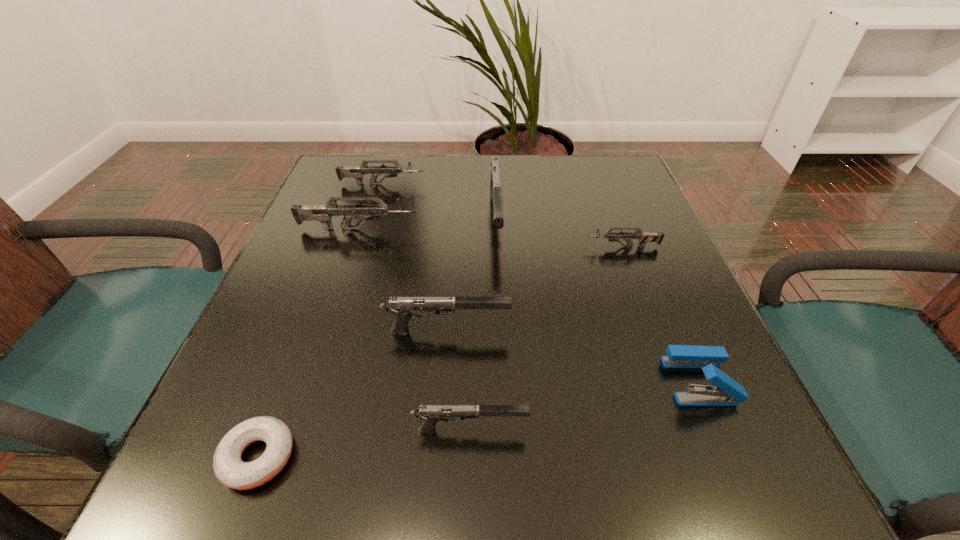
Identify the location of vacant space in between the blue stapler and the farthest gun. This screenshot has height=540, width=960. (540, 282).

The width and height of the screenshot is (960, 540). In order to click on vacant space that's between the fifth farthest gun and the farthest gun in this screenshot , I will do `click(415, 257)`.

Identify the location of vacant area that lies between the blue stapler and the biggest grey gun. The height and width of the screenshot is (540, 960). (529, 305).

Find the location of a particular element. empty location between the shortest object and the smallest gray gun is located at coordinates (364, 443).

You are a GUI agent. You are given a task and a screenshot of the screen. Output one action in this format:
    pyautogui.click(x=<x>, y=<y>)
    Task: Click on the vacant area that lies between the smallest grey gun and the second nearest grey gun
    This screenshot has height=540, width=960.
    Given the screenshot: What is the action you would take?
    pyautogui.click(x=491, y=238)

Locate an element on the screen. This screenshot has height=540, width=960. object that is the second closest one to the second smallest grey gun is located at coordinates click(x=323, y=213).

You are a GUI agent. You are given a task and a screenshot of the screen. Output one action in this format:
    pyautogui.click(x=<x>, y=<y>)
    Task: Click on the second closest object relative to the farthest gray gun
    This screenshot has height=540, width=960.
    Given the screenshot: What is the action you would take?
    pyautogui.click(x=357, y=172)

Identify the location of gun that is the fourth closest to the shortest object. (496, 194).

At what (x,y) coordinates should I click in order to perform the action: click on the closest gun to the tallest object. Please return your answer as a coordinate pair (x, y). The width and height of the screenshot is (960, 540). Looking at the image, I should click on (323, 213).

Identify which gray gun is the third closest to the sixth farthest object. Please provide its 2D coordinates. Your answer should be formatted as a tuple, i.e. [(x, y)], where the tuple contains the x and y coordinates of a point satisfying the conditions above.

[(496, 194)]